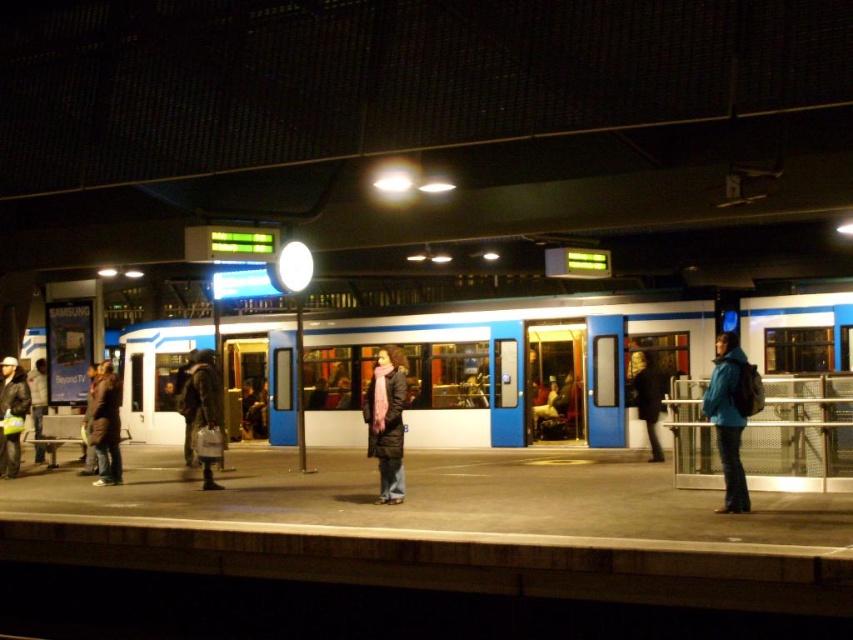
Question: Does teal matte jacket at right have a greater width compared to dark blue jacket at center?

Choices:
 (A) yes
 (B) no

Answer: (A)

Question: Considering the relative positions of blue/white train at center and matte black coat at center in the image provided, where is blue/white train at center located with respect to matte black coat at center?

Choices:
 (A) below
 (B) above

Answer: (B)

Question: Which object is farther from the camera taking this photo?

Choices:
 (A) blue/white train at center
 (B) matte black jacket at left
 (C) dark blue jeans at lower left
 (D) teal matte jacket at right

Answer: (C)

Question: Can you confirm if blue/white train at center is smaller than matte black jacket at left?

Choices:
 (A) yes
 (B) no

Answer: (B)

Question: Which object appears farthest from the camera in this image?

Choices:
 (A) teal matte jacket at right
 (B) dark blue jacket at center

Answer: (B)

Question: Which of the following is the closest to the observer?

Choices:
 (A) (18, 384)
 (B) (209, 403)
 (C) (727, 340)

Answer: (C)